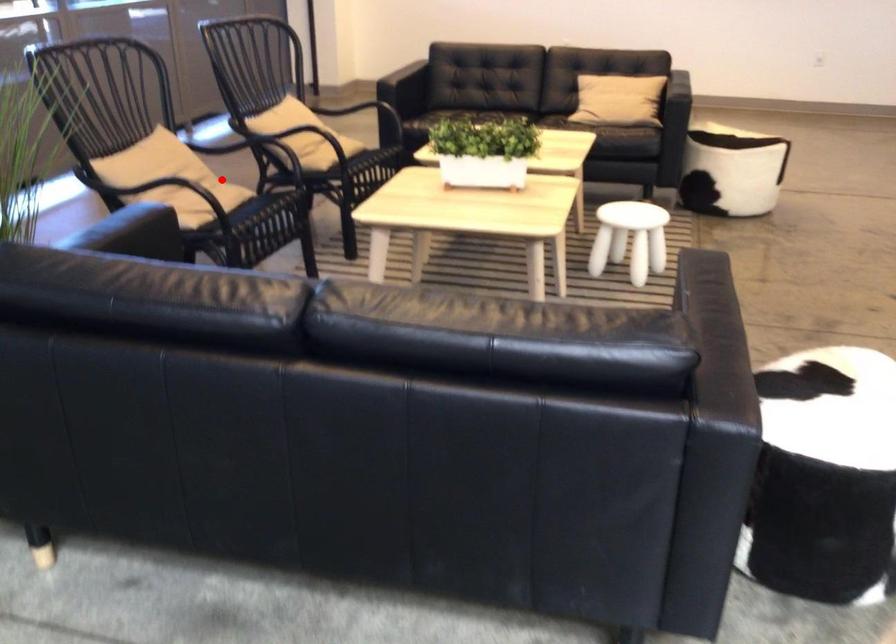
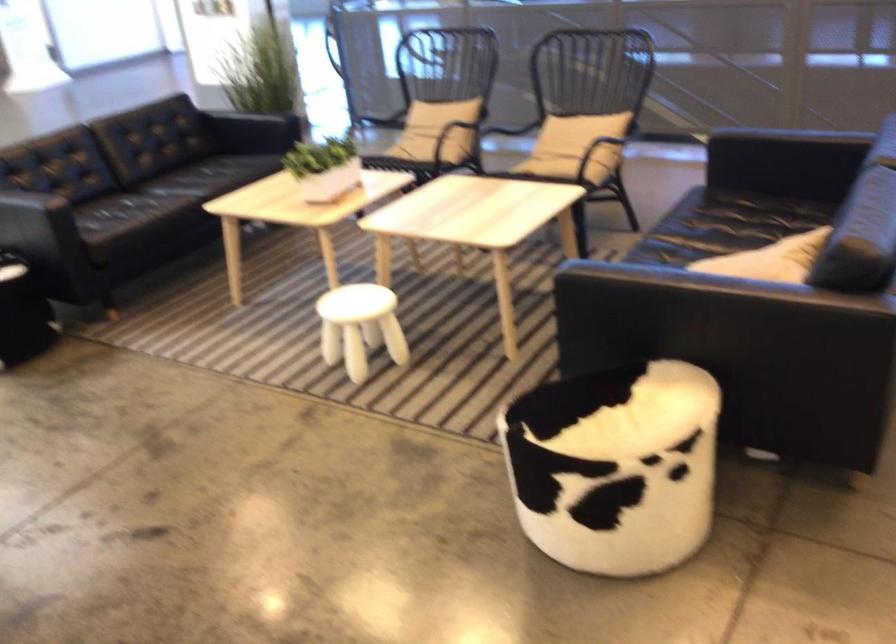
The point at the highlighted location is marked in the first image. Where is the corresponding point in the second image?

(450, 135)